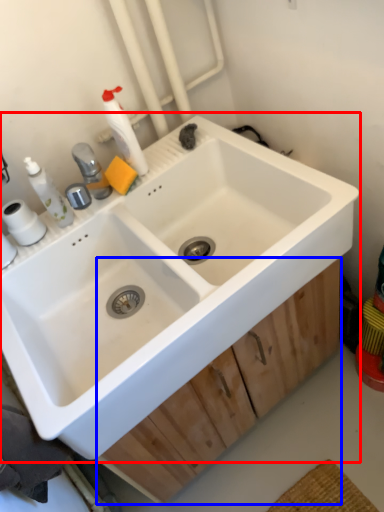
Question: Which object is further to the camera taking this photo, sink (highlighted by a red box) or drawer (highlighted by a blue box)?

Choices:
 (A) sink
 (B) drawer

Answer: (B)